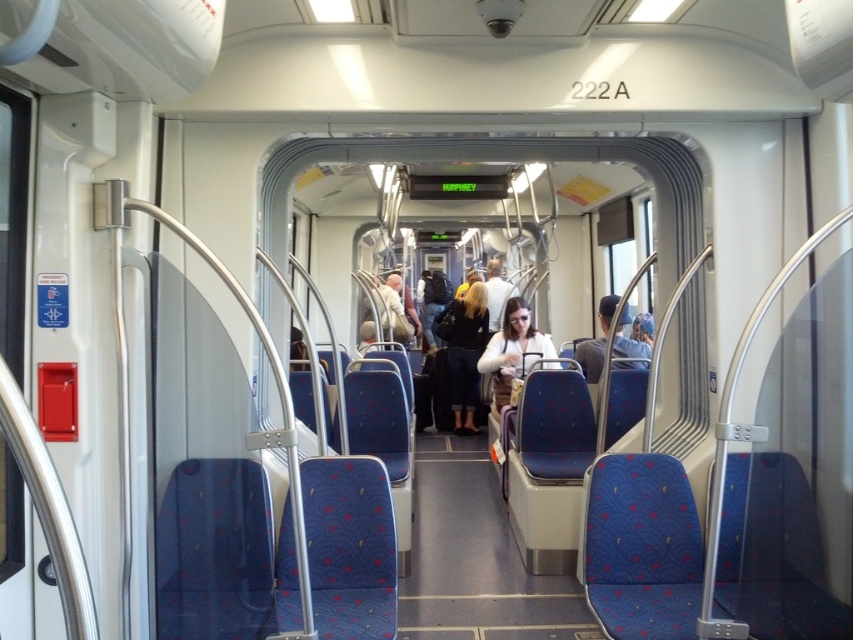
Question: In this image, where is dark blue fabric coat at center located relative to matte white jacket at center?

Choices:
 (A) above
 (B) below

Answer: (B)

Question: Is dark blue fabric coat at center positioned behind matte white jacket at center?

Choices:
 (A) yes
 (B) no

Answer: (A)

Question: Among these points, which one is nearest to the camera?

Choices:
 (A) (595, 352)
 (B) (517, 321)
 (C) (450, 353)

Answer: (A)

Question: Among these points, which one is nearest to the camera?

Choices:
 (A) (637, 360)
 (B) (457, 360)

Answer: (A)

Question: Is dark blue fabric coat at center to the right of denim jacket at center from the viewer's perspective?

Choices:
 (A) yes
 (B) no

Answer: (B)

Question: Which object appears farthest from the camera in this image?

Choices:
 (A) matte white jacket at center
 (B) denim jacket at center

Answer: (A)